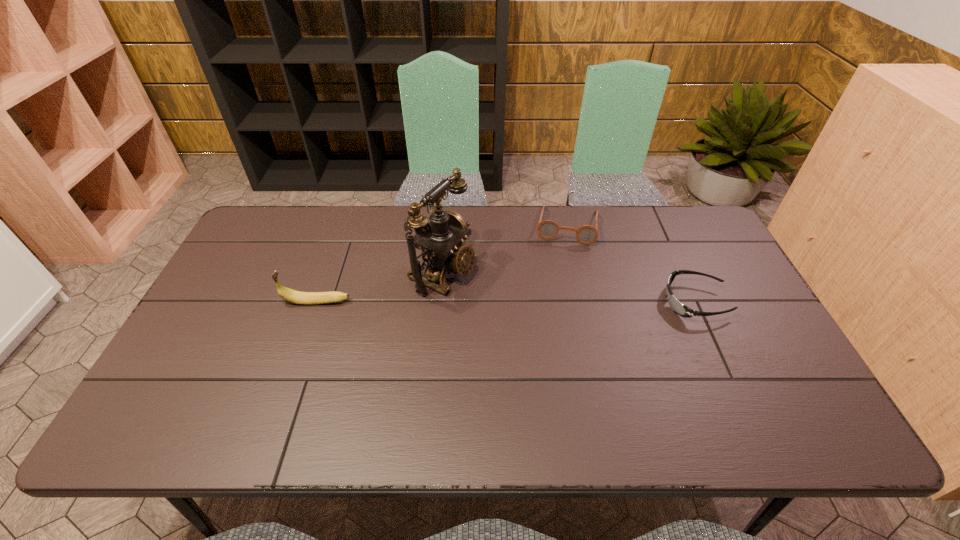
Identify the location of free space located 0.150m on the lenses of the rightmost object. The width and height of the screenshot is (960, 540). (610, 302).

Where is `free space located on the lenses of the rightmost object`? The width and height of the screenshot is (960, 540). free space located on the lenses of the rightmost object is located at coordinates (571, 302).

Locate an element on the screen. The height and width of the screenshot is (540, 960). free space located on the lenses of the rightmost object is located at coordinates (628, 302).

Where is `free space located 0.110m on the rotary dial of the tallest object`? free space located 0.110m on the rotary dial of the tallest object is located at coordinates (506, 301).

Image resolution: width=960 pixels, height=540 pixels. Identify the location of vacant space located on the rotary dial of the tallest object. (496, 297).

Locate an element on the screen. free space located on the rotary dial of the tallest object is located at coordinates (575, 332).

Image resolution: width=960 pixels, height=540 pixels. Find the location of `vacant region located on the front-facing side of the third tallest object`. vacant region located on the front-facing side of the third tallest object is located at coordinates (553, 334).

The height and width of the screenshot is (540, 960). I want to click on free region located on the front-facing side of the third tallest object, so click(x=556, y=312).

This screenshot has height=540, width=960. Identify the location of free point located 0.140m on the front-facing side of the third tallest object. (561, 276).

Where is `telephone at the far edge`? The height and width of the screenshot is (540, 960). telephone at the far edge is located at coordinates (440, 241).